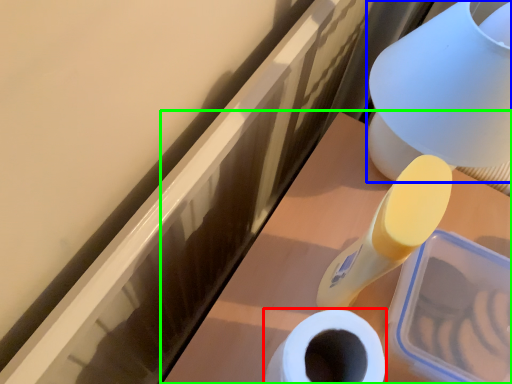
Question: Which object is the closest to the toilet paper (highlighted by a red box)? Choose among these: table lamp (highlighted by a blue box) or vanity (highlighted by a green box).

Choices:
 (A) table lamp
 (B) vanity

Answer: (B)